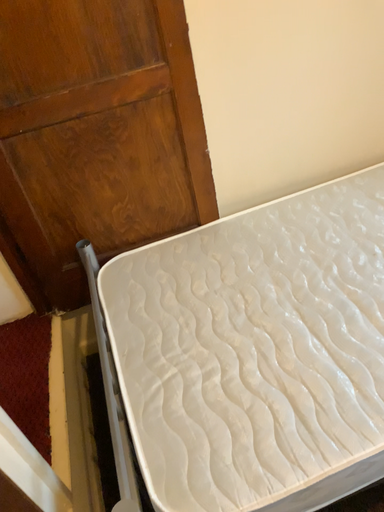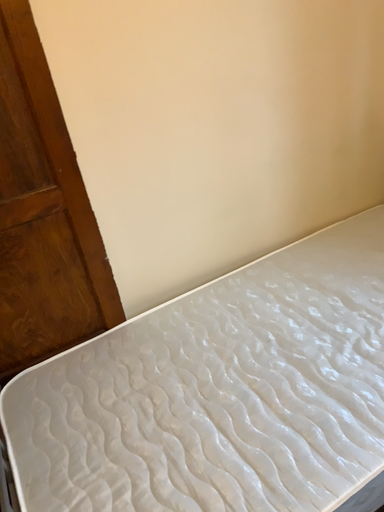
Question: How did the camera likely rotate when shooting the video?

Choices:
 (A) rotated left
 (B) rotated right

Answer: (B)